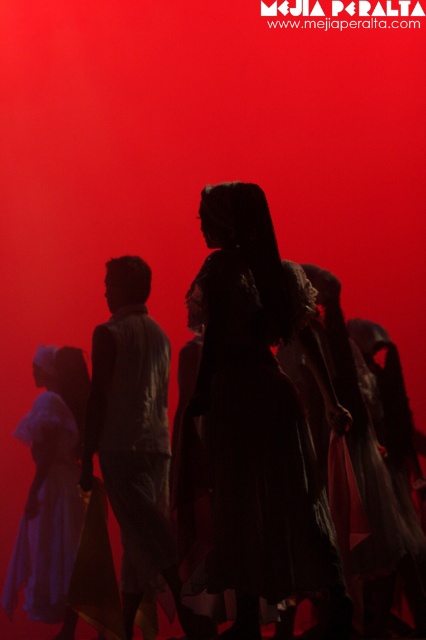
Question: Where is silhouette dress at center located in relation to matte gray shirt at center in the image?

Choices:
 (A) right
 (B) left

Answer: (A)

Question: Where is silhouette dress at center located in relation to matte gray shirt at center in the image?

Choices:
 (A) left
 (B) right

Answer: (B)

Question: Among these objects, which one is farthest from the camera?

Choices:
 (A) silhouette dress at center
 (B) matte gray shirt at center

Answer: (B)

Question: Can you confirm if silhouette dress at center is positioned above matte gray shirt at center?

Choices:
 (A) yes
 (B) no

Answer: (A)